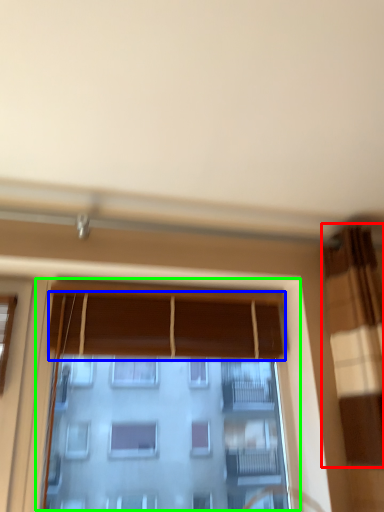
Question: Which object is the farthest from curtain (highlighted by a red box)? Choose among these: curtain (highlighted by a blue box) or window (highlighted by a green box).

Choices:
 (A) curtain
 (B) window

Answer: (A)